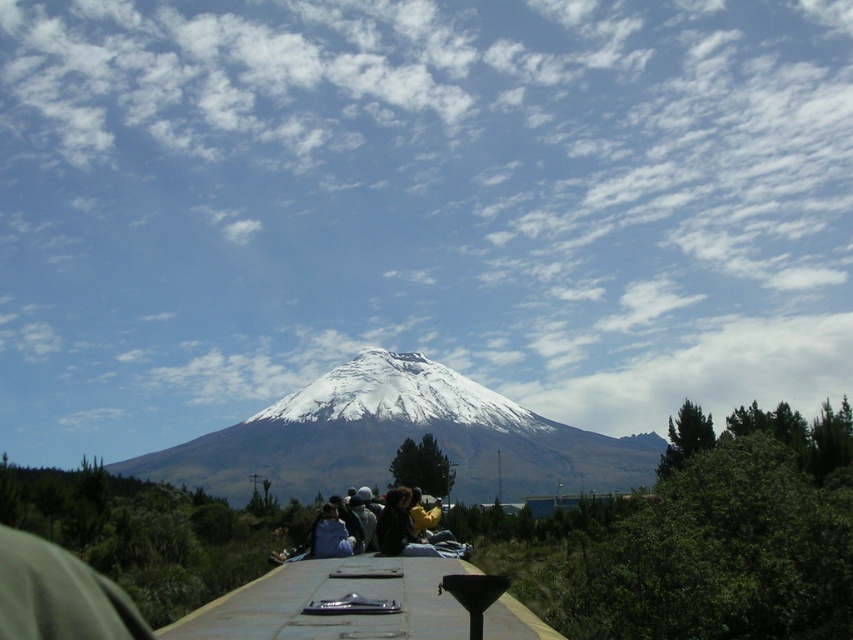
Based on the photo, which is more to the left, snowy volcanic peak at center or white snow-covered mountain at center?

white snow-covered mountain at center is more to the left.

Who is positioned more to the right, snowy volcanic peak at center or white snow-covered mountain at center?

snowy volcanic peak at center

Is point (316, 451) positioned before point (450, 378)?

Yes, it is in front of point (450, 378).

You are a GUI agent. You are given a task and a screenshot of the screen. Output one action in this format:
    pyautogui.click(x=<x>, y=<y>)
    Task: Click on the snowy volcanic peak at center
    This screenshot has width=853, height=640.
    Given the screenshot: What is the action you would take?
    pyautogui.click(x=399, y=438)

Which is behind, point (457, 420) or point (426, 548)?

The point (457, 420) is behind.

Is white snow-covered mountain at center to the left of dark brown fabric jacket at center from the viewer's perspective?

Yes, white snow-covered mountain at center is to the left of dark brown fabric jacket at center.

Which is in front, point (424, 364) or point (444, 538)?

Point (444, 538) is in front.

The height and width of the screenshot is (640, 853). In order to click on white snow-covered mountain at center in this screenshot , I will do `click(399, 396)`.

Can you confirm if snowy volcanic peak at center is thinner than dark brown fabric jacket at center?

In fact, snowy volcanic peak at center might be wider than dark brown fabric jacket at center.

Is point (605, 476) closer to viewer compared to point (312, 541)?

No, (605, 476) is further to viewer.

Between point (146, 458) and point (383, 548), which one is positioned in front?

Point (383, 548) is in front.

Identify the location of snowy volcanic peak at center. click(399, 438).